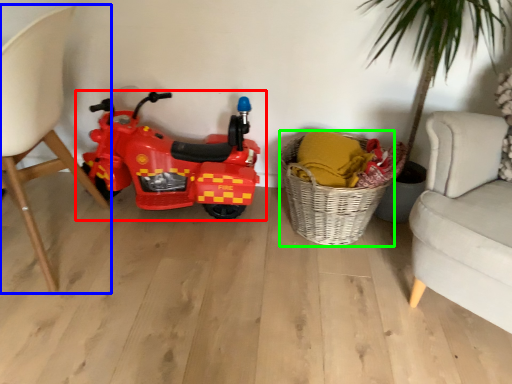
Question: Estimate the real-world distances between objects in this image. Which object is closer to land vehicle (highlighted by a red box), chair (highlighted by a blue box) or basket (highlighted by a green box)?

Choices:
 (A) chair
 (B) basket

Answer: (A)